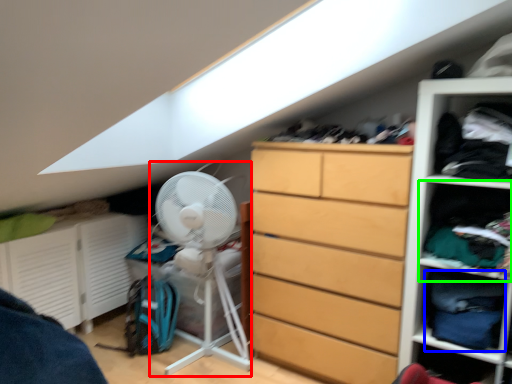
Question: Estimate the real-world distances between objects in this image. Which object is closer to fan (highlighted by a red box), clothing (highlighted by a blue box) or cabinet (highlighted by a green box)?

Choices:
 (A) clothing
 (B) cabinet

Answer: (B)